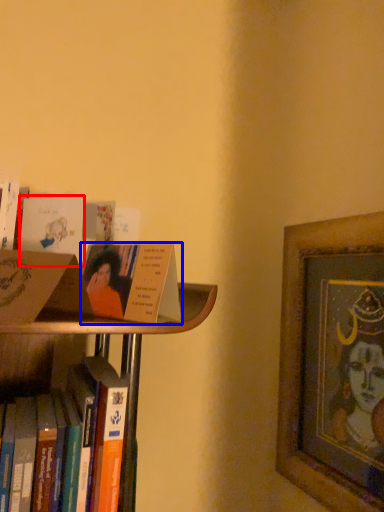
Question: Which object appears farthest to the camera in this image, paperback book (highlighted by a red box) or book (highlighted by a blue box)?

Choices:
 (A) paperback book
 (B) book

Answer: (A)